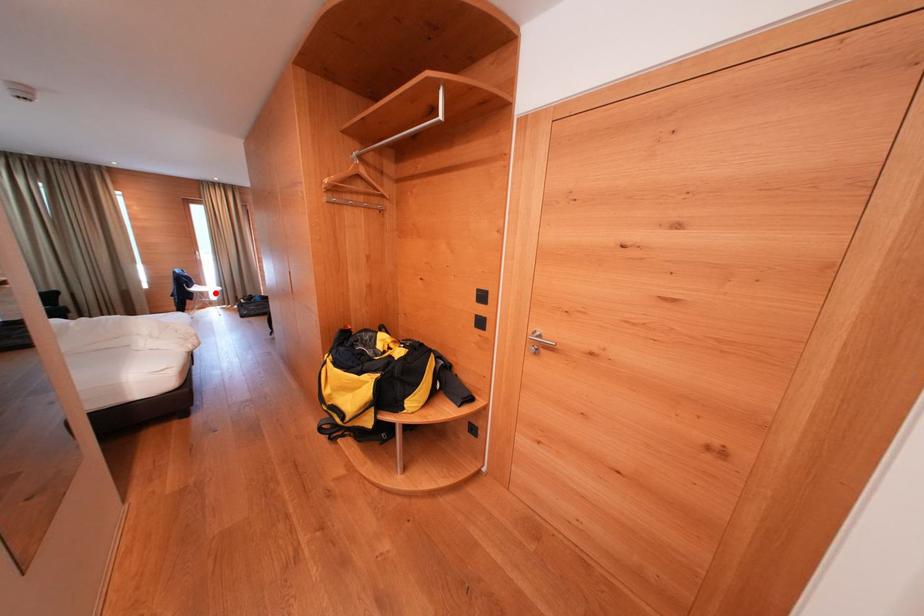
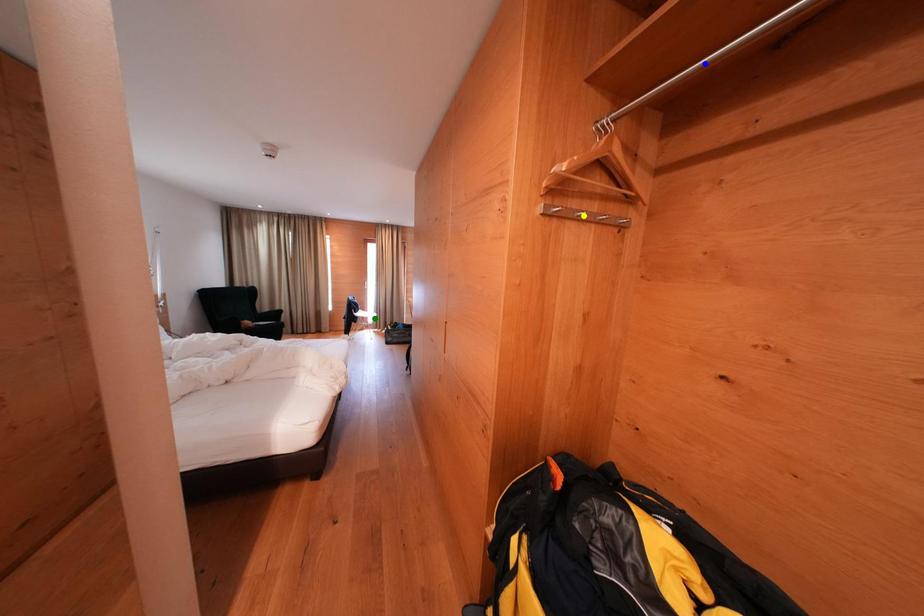
Question: I am providing you with two images of the same scene from different viewpoints. A red point is marked on the first image. You are given multiple points on the second image. Which spot in image 2 lines up with the point in image 1?

Choices:
 (A) yellow point
 (B) green point
 (C) blue point

Answer: (B)